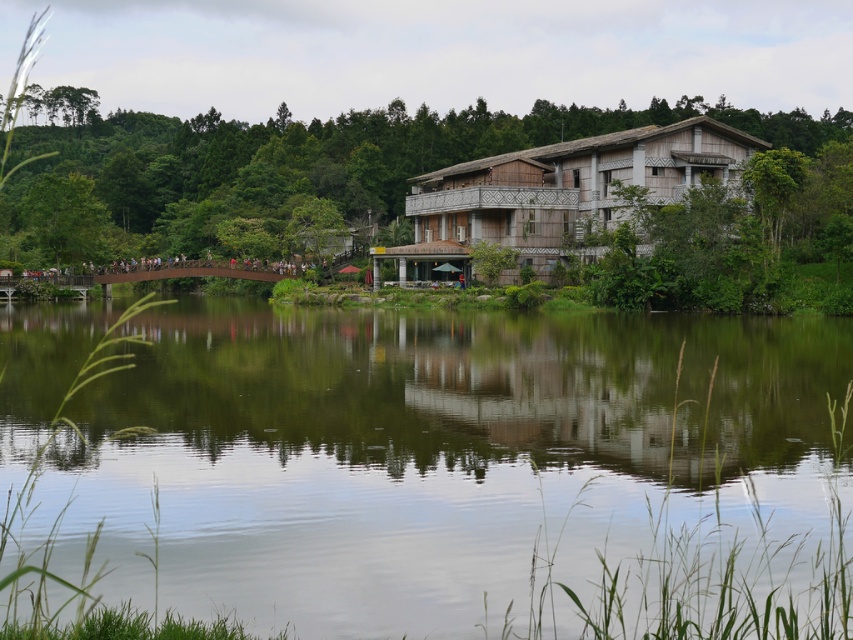
Does point (534, 314) come closer to viewer compared to point (410, 198)?

Yes, it is in front of point (410, 198).

Who is lower down, green reflective water at center or wooden hut at center?

green reflective water at center is below.

Is point (833, 451) positioned in front of point (677, 128)?

That is True.

Where is `green reflective water at center`? green reflective water at center is located at coordinates (427, 452).